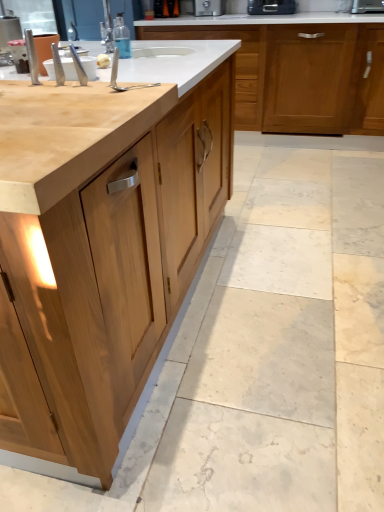
Question: Is matte wood cabinet at center, the 2th cabinetry in the front-to-back sequence, bigger or smaller than metallic silver toaster at upper right, which is the second appliance in left-to-right order?

Choices:
 (A) big
 (B) small

Answer: (A)

Question: Considering their positions, is matte wood cabinet at center, the 2th cabinetry in the front-to-back sequence, located in front of or behind metallic silver toaster at upper right, the 1th appliance in the right-to-left sequence?

Choices:
 (A) behind
 (B) front

Answer: (B)

Question: Considering the real-world distances, which object is farthest from the matte wood cabinet at center, the 2th cabinetry in the front-to-back sequence?

Choices:
 (A) metallic silver toaster at upper right, which is the second appliance in left-to-right order
 (B) black plastic toaster at upper center, which ranks as the 1th appliance in left-to-right order
 (C) transparent plastic bottle at upper center
 (D) natural wood cabinet at center, which is the 1th cabinetry in front-to-back order

Answer: (D)

Question: Which object is the farthest from the matte wood cabinet at center, the 2th cabinetry in the front-to-back sequence?

Choices:
 (A) metallic silver toaster at upper right, which is the second appliance in left-to-right order
 (B) natural wood cabinet at center, which is the 1th cabinetry in front-to-back order
 (C) black plastic toaster at upper center, which ranks as the 1th appliance in left-to-right order
 (D) transparent plastic bottle at upper center

Answer: (B)